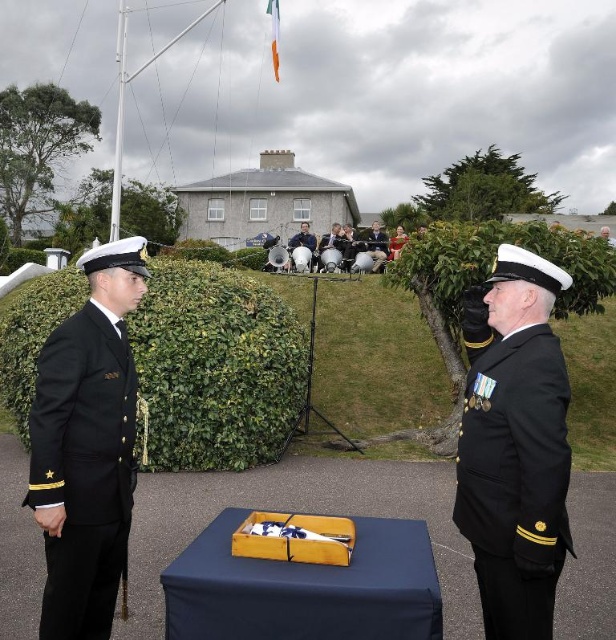
Between black matte uniform at right and black matte uniform at left, which one is positioned higher?

black matte uniform at right is above.

At what (x,y) coordinates should I click in order to perform the action: click on black matte uniform at right. Please return your answer as a coordinate pair (x, y). The width and height of the screenshot is (616, 640). Looking at the image, I should click on (514, 474).

Is smooth white uniform at center positioned before dark blue uniform at center?

No, it is not.

Does smooth white uniform at center have a greater width compared to dark blue uniform at center?

In fact, smooth white uniform at center might be narrower than dark blue uniform at center.

Identify the location of smooth white uniform at center. Image resolution: width=616 pixels, height=640 pixels. 302,246.

In the scene shown: How far apart are green leafy hedge at center and smooth white uniform at center?

They are 11.78 meters apart.

Which is more to the left, green leafy hedge at center or smooth white uniform at center?

From the viewer's perspective, green leafy hedge at center appears more on the left side.

Does point (62, 307) lie in front of point (304, 236)?

Yes.

Image resolution: width=616 pixels, height=640 pixels. Find the location of `green leafy hedge at center`. green leafy hedge at center is located at coordinates (216, 369).